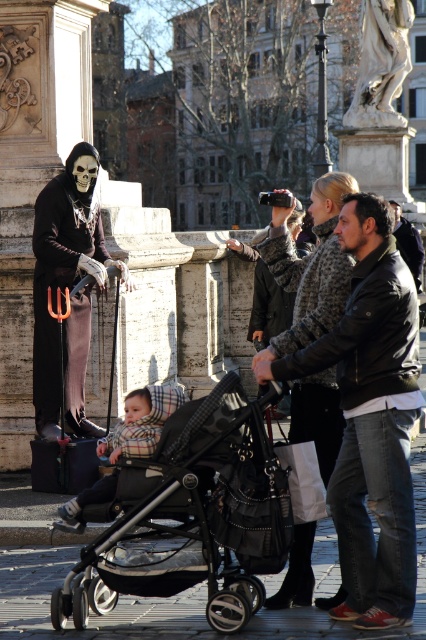
You are standing at the point with coordinates point (356, 428) and want to walk towards the point with coordinates point (224, 572). Will you be moving forward or backward relative to the direction you are facing?

Since point (224, 572) is in front of point (356, 428), you will be moving forward relative to the direction you are facing.

You are a photographer trying to capture both the white marble statue at upper center and the plaid fabric baby carriage at center in a single shot. Based on their sizes, which object should you focus on to ensure both are clearly visible in the frame?

The white marble statue at upper center is larger than the plaid fabric baby carriage at center, so you should focus on the statue to ensure both are clearly visible in the frame.

You are a photographer trying to capture a wide shot of the white marble statue at upper center and the plaid fabric baby carriage at center. Given the statue is wider than the carriage, which object will require a wider lens setting to capture its full width in the frame?

The white marble statue at upper center will require a wider lens setting because it is wider than the plaid fabric baby carriage at center.